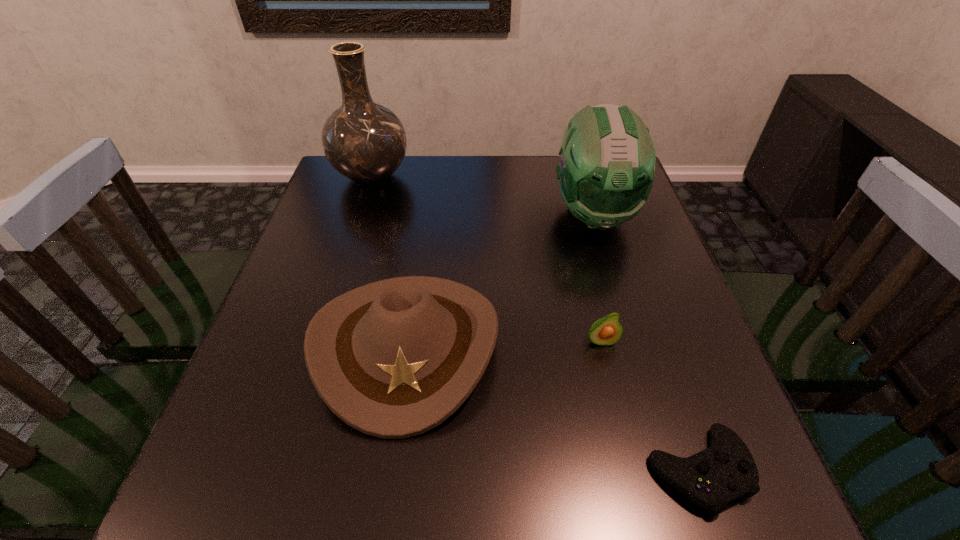
Where is `football helmet that is at the far edge`? football helmet that is at the far edge is located at coordinates [607, 158].

Locate an element on the screen. The width and height of the screenshot is (960, 540). object situated at the near edge is located at coordinates (712, 478).

Image resolution: width=960 pixels, height=540 pixels. Find the location of `vase that is positioned at the left edge`. vase that is positioned at the left edge is located at coordinates (364, 141).

Find the location of a particular element. The width and height of the screenshot is (960, 540). cowboy hat that is at the left edge is located at coordinates (395, 358).

At what (x,y) coordinates should I click in order to perform the action: click on football helmet present at the right edge. Please return your answer as a coordinate pair (x, y). The width and height of the screenshot is (960, 540). Looking at the image, I should click on (607, 158).

Identify the location of control present at the right edge. (712, 478).

You are a GUI agent. You are given a task and a screenshot of the screen. Output one action in this format:
    pyautogui.click(x=<x>, y=<y>)
    Task: Click on the object that is at the far left corner
    The height and width of the screenshot is (540, 960).
    Given the screenshot: What is the action you would take?
    pos(364,141)

At what (x,y) coordinates should I click in order to perform the action: click on object that is at the far right corner. Please return your answer as a coordinate pair (x, y). The width and height of the screenshot is (960, 540). Looking at the image, I should click on (607, 158).

You are a GUI agent. You are given a task and a screenshot of the screen. Output one action in this format:
    pyautogui.click(x=<x>, y=<y>)
    Task: Click on the object at the near right corner
    The width and height of the screenshot is (960, 540).
    Given the screenshot: What is the action you would take?
    712,478

Where is `free space at the far edge of the desktop`? The width and height of the screenshot is (960, 540). free space at the far edge of the desktop is located at coordinates (513, 172).